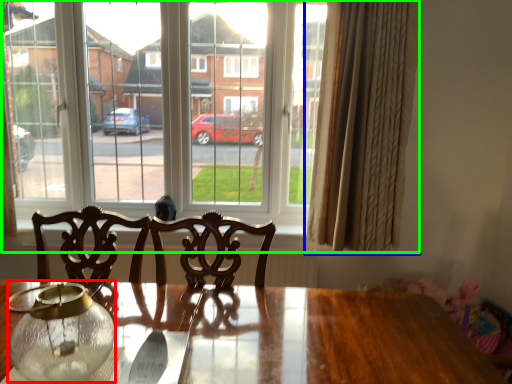
Question: Which is nearer to the glass vase (highlighted by a red box)? curtain (highlighted by a blue box) or window (highlighted by a green box).

Choices:
 (A) curtain
 (B) window

Answer: (A)